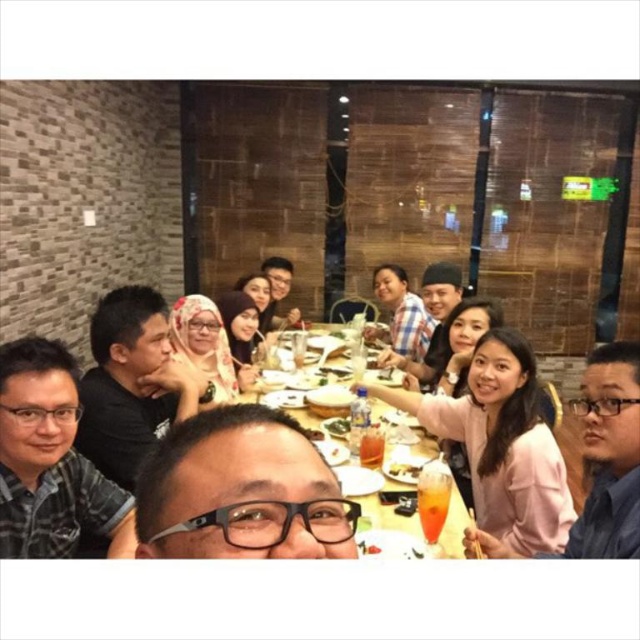
Question: Which of the following is the farthest from the observer?

Choices:
 (A) pink fabric shirt at center
 (B) pink fabric shirt at lower right
 (C) matte black shirt at center
 (D) black matte shirt at left

Answer: (D)

Question: In this image, where is pink fabric shirt at center located relative to yellow matte plate at center?

Choices:
 (A) left
 (B) right

Answer: (B)

Question: Is yellow plastic table at center wider than yellow matte plate at center?

Choices:
 (A) no
 (B) yes

Answer: (B)

Question: Among these points, which one is nearest to the camera?

Choices:
 (A) (394, 465)
 (B) (109, 470)
 (C) (609, 515)
 (D) (422, 451)

Answer: (C)

Question: Can you confirm if pink fabric shirt at center is thinner than yellow plastic table at center?

Choices:
 (A) no
 (B) yes

Answer: (A)

Question: Which of the following is the closest to the observer?

Choices:
 (A) pink fabric shirt at lower right
 (B) matte black shirt at center

Answer: (A)